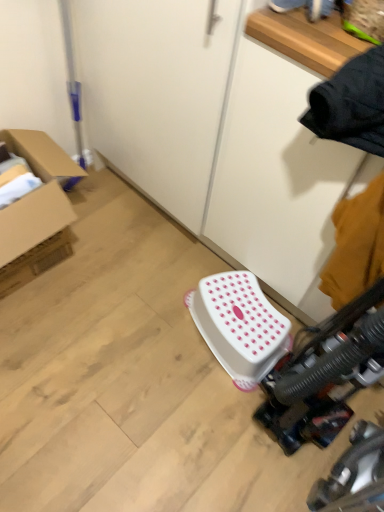
In order to face cardboard box at left, should I rotate leftwards or rightwards?

You should look left and rotate roughly 20.611 degrees.

The image size is (384, 512). Describe the element at coordinates (36, 195) in the screenshot. I see `cardboard box at left` at that location.

In order to click on cardboard box at left in this screenshot , I will do `click(36, 195)`.

Measure the distance between cardboard box at left and camera.

They are 1.17 meters apart.

Measure the distance between white plastic stool at center and camera.

white plastic stool at center and camera are 1.29 meters apart from each other.

This screenshot has width=384, height=512. Identify the location of white plastic stool at center. (239, 326).

Describe the element at coordinates (239, 326) in the screenshot. I see `white plastic stool at center` at that location.

Where is `cardboard box at left`? This screenshot has width=384, height=512. cardboard box at left is located at coordinates (36, 195).

In the image, is white plastic stool at center on the left side or the right side of cardboard box at left?

In the image, white plastic stool at center appears on the right side of cardboard box at left.

Does white plastic stool at center come behind cardboard box at left?

Yes, it is.

Is point (220, 360) more distant than point (4, 238)?

Yes, point (220, 360) is farther from viewer.

From the image's perspective, who appears lower, white plastic stool at center or cardboard box at left?

white plastic stool at center appears lower in the image.

From a real-world perspective, is white plastic stool at center physically below cardboard box at left?

Yes, from a real-world perspective, white plastic stool at center is under cardboard box at left.

Which of these two, white plastic stool at center or cardboard box at left, is wider?

cardboard box at left.

In terms of height, does white plastic stool at center look taller or shorter compared to cardboard box at left?

Clearly, white plastic stool at center is shorter compared to cardboard box at left.

Which of these two, white plastic stool at center or cardboard box at left, is smaller?

With smaller size is white plastic stool at center.

Is white plastic stool at center surrounding cardboard box at left?

No, cardboard box at left is not inside white plastic stool at center.

Would you say white plastic stool at center is a long distance from cardboard box at left?

No.

Is cardboard box at left at the back of white plastic stool at center?

No.

How different are the orientations of white plastic stool at center and cardboard box at left in degrees?

107 degrees separate the facing orientations of white plastic stool at center and cardboard box at left.

Identify the location of stool that is below the cardboard box at left (from the image's perspective). This screenshot has height=512, width=384. (239, 326).

In the scene shown: Which object is positioned more to the left, cardboard box at left or white plastic stool at center?

cardboard box at left.

In the image, is cardboard box at left positioned in front of or behind white plastic stool at center?

cardboard box at left is in front of white plastic stool at center.

Which point is more distant from viewer, (x=72, y=162) or (x=223, y=308)?

The point (x=72, y=162) is more distant.

From the image's perspective, would you say cardboard box at left is positioned over white plastic stool at center?

Correct, cardboard box at left appears higher than white plastic stool at center in the image.

From a real-world perspective, does cardboard box at left stand above white plastic stool at center?

Yes, from a real-world perspective, cardboard box at left is on top of white plastic stool at center.

Which object is wider, cardboard box at left or white plastic stool at center?

cardboard box at left is wider.

Considering the relative sizes of cardboard box at left and white plastic stool at center in the image provided, is cardboard box at left shorter than white plastic stool at center?

In fact, cardboard box at left may be taller than white plastic stool at center.

Looking at this image, can you confirm if cardboard box at left is bigger than white plastic stool at center?

Indeed, cardboard box at left has a larger size compared to white plastic stool at center.

Would you say white plastic stool at center is part of cardboard box at left's contents?

No.

Would you say cardboard box at left is a long distance from white plastic stool at center?

Actually, cardboard box at left and white plastic stool at center are a little close together.

Does cardboard box at left turn towards white plastic stool at center?

Yes, cardboard box at left faces towards white plastic stool at center.

How different are the orientations of cardboard box at left and white plastic stool at center in degrees?

The facing directions of cardboard box at left and white plastic stool at center are 107 degrees apart.

From the picture: How far apart are cardboard box at left and white plastic stool at center?

cardboard box at left is 24.64 inches from white plastic stool at center.

The width and height of the screenshot is (384, 512). I want to click on stool below the cardboard box at left (from a real-world perspective), so click(x=239, y=326).

Find the location of `box in front of the white plastic stool at center`. box in front of the white plastic stool at center is located at coordinates pyautogui.click(x=36, y=195).

Find the location of a particular element. box that appears above the white plastic stool at center (from a real-world perspective) is located at coordinates [x=36, y=195].